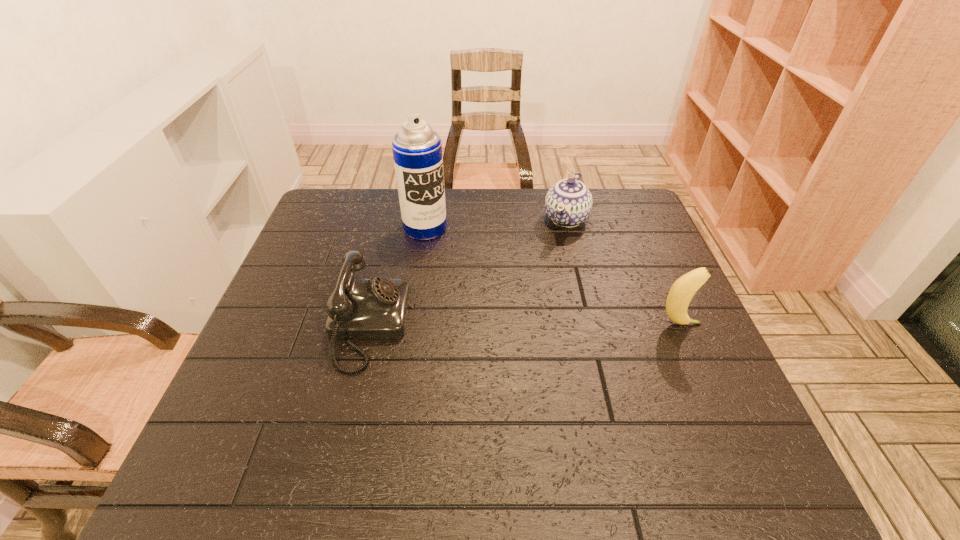
Find the location of a particular element. vacant space on the desktop that is between the telephone and the third shortest object and is positioned on the label side of the aerosol can is located at coordinates (497, 325).

At what (x,y) coordinates should I click in order to perform the action: click on free space on the desktop that is between the telephone and the second tallest object and is positioned at the spout of the third object from left to right. Please return your answer as a coordinate pair (x, y). Looking at the image, I should click on (513, 325).